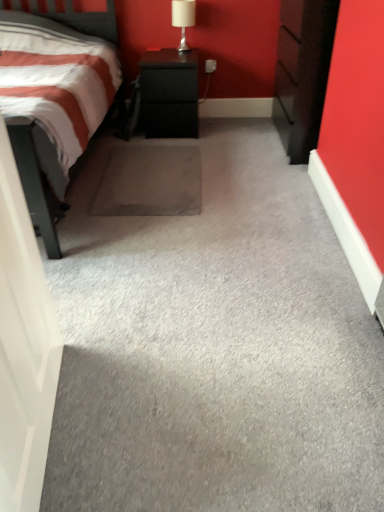
Question: Is dark wood chest of drawers at right spatially inside white glossy table lamp at upper center, or outside of it?

Choices:
 (A) outside
 (B) inside

Answer: (A)

Question: Relative to white glossy table lamp at upper center, is dark wood chest of drawers at right in front or behind?

Choices:
 (A) behind
 (B) front

Answer: (B)

Question: Estimate the real-world distances between objects in this image. Which object is farther from the black textured cabinet at center?

Choices:
 (A) white glossy door at left
 (B) gray carpet at center
 (C) white glossy table lamp at upper center
 (D) dark wood chest of drawers at right

Answer: (A)

Question: Which is farther from the white glossy door at left?

Choices:
 (A) dark wood chest of drawers at right
 (B) gray carpet at center
 (C) white glossy table lamp at upper center
 (D) black textured cabinet at center

Answer: (C)